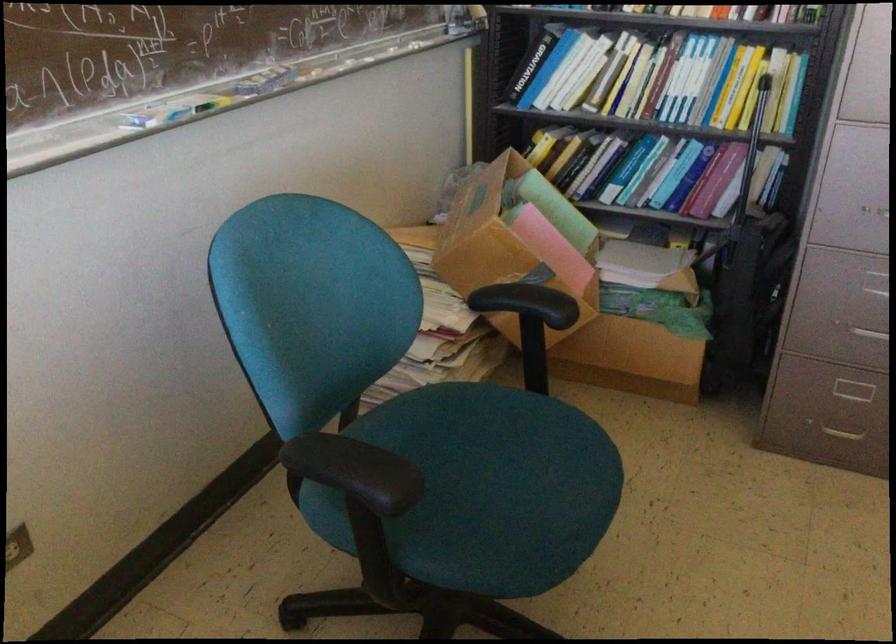
This screenshot has height=644, width=896. In order to click on blue chair sitting surface in this screenshot , I will do `click(498, 458)`.